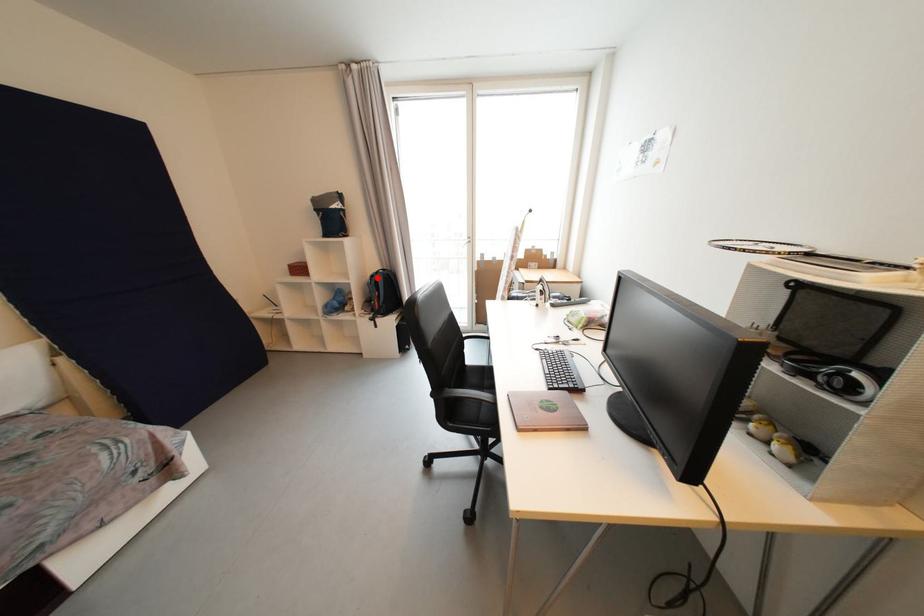
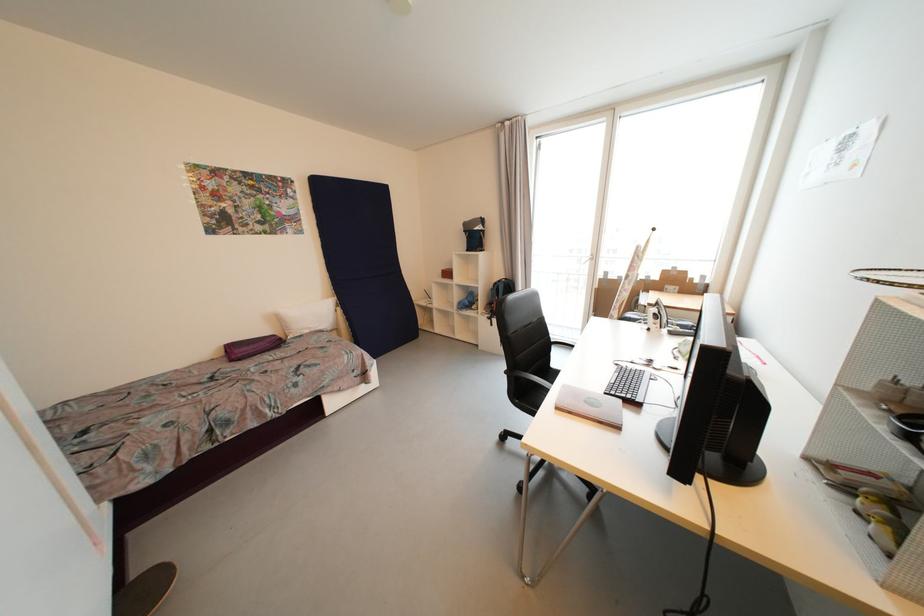
Where in the second image is the point corresponding to the highlighted location from the first image?

(501, 285)